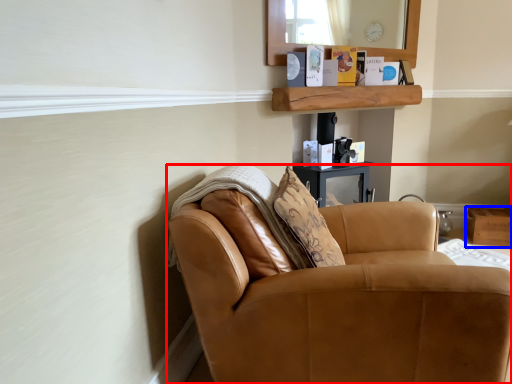
Question: Which object appears farthest to the camera in this image, chair (highlighted by a red box) or box (highlighted by a blue box)?

Choices:
 (A) chair
 (B) box

Answer: (B)